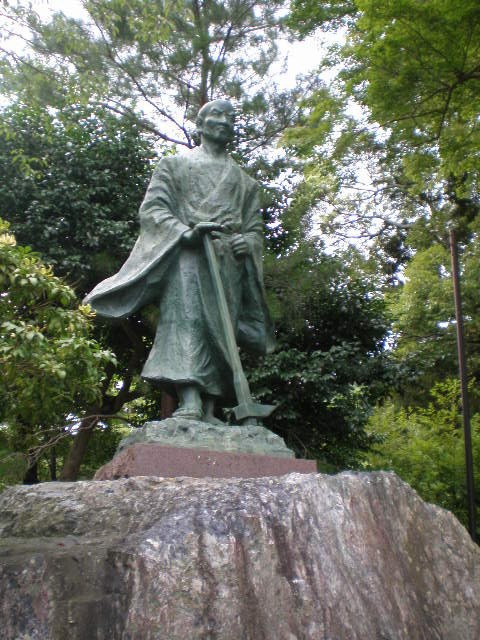
The height and width of the screenshot is (640, 480). I want to click on statue, so click(x=209, y=212).